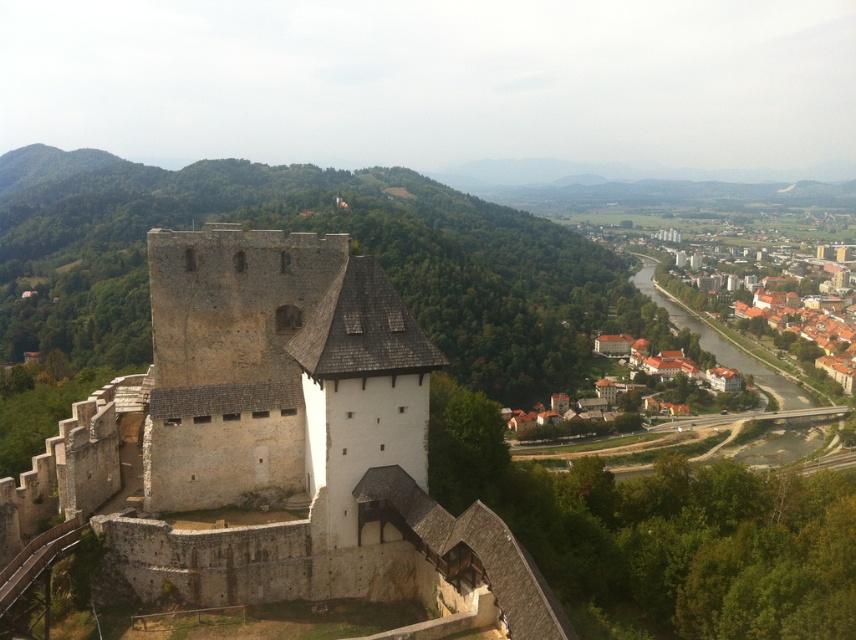
Question: Does white stone castle at center have a lesser width compared to brown tiled roofs at lower right?

Choices:
 (A) yes
 (B) no

Answer: (A)

Question: Which of the following is the closest to the observer?

Choices:
 (A) brown tiled roofs at lower right
 (B) white stone castle at center

Answer: (B)

Question: Does white stone castle at center appear on the right side of brown tiled roofs at lower right?

Choices:
 (A) yes
 (B) no

Answer: (B)

Question: Is white stone castle at center to the right of brown tiled roofs at lower right from the viewer's perspective?

Choices:
 (A) yes
 (B) no

Answer: (B)